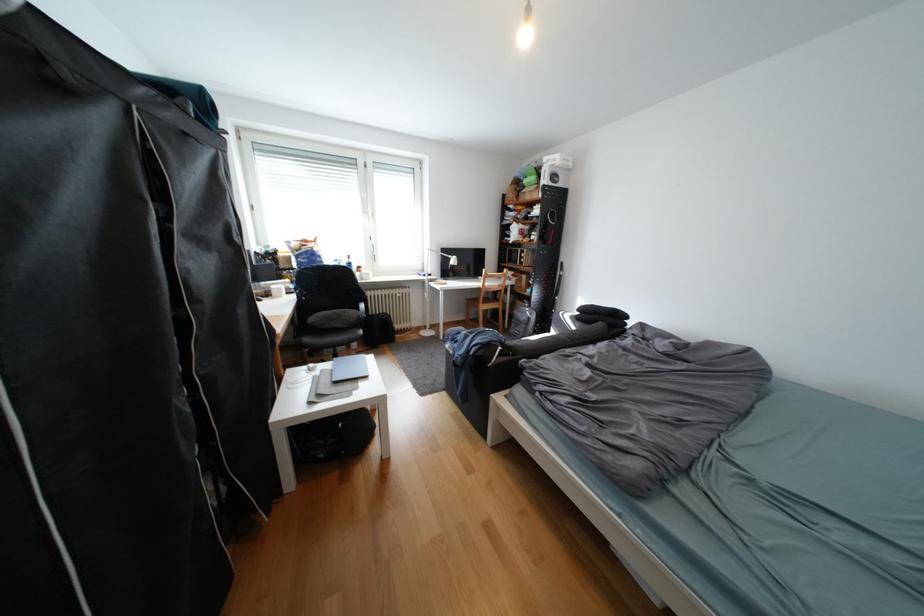
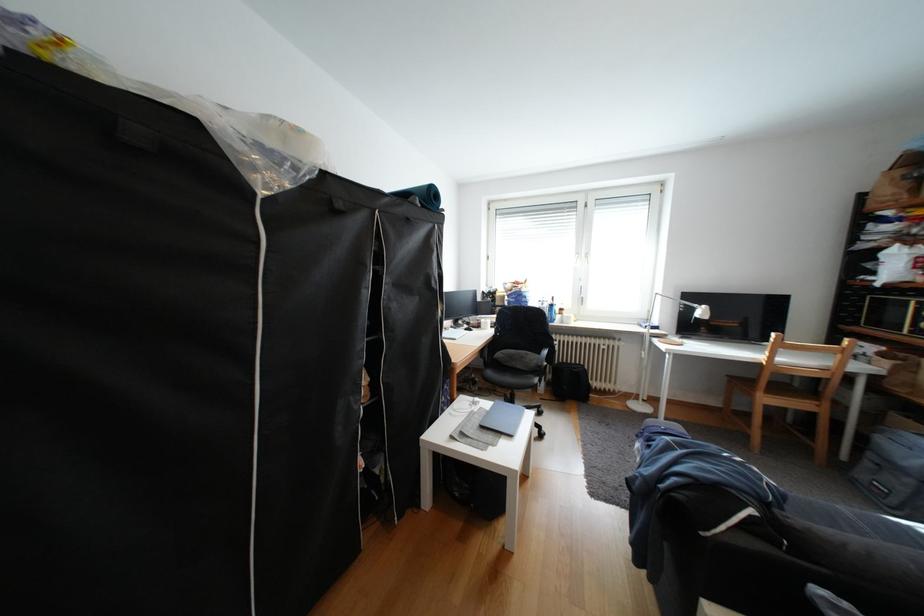
In the second image, find the point that corresponds to pixel 495 307 in the first image.

(779, 400)